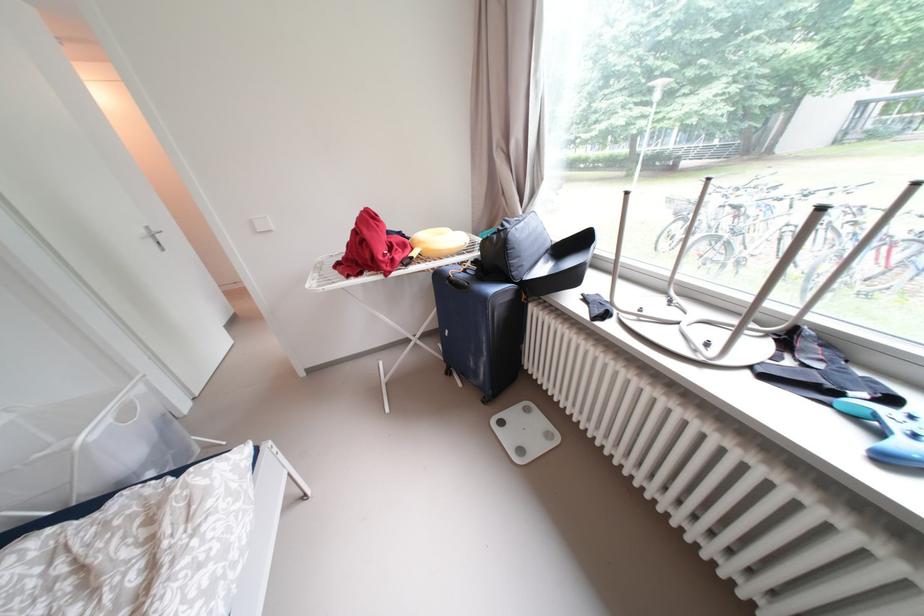
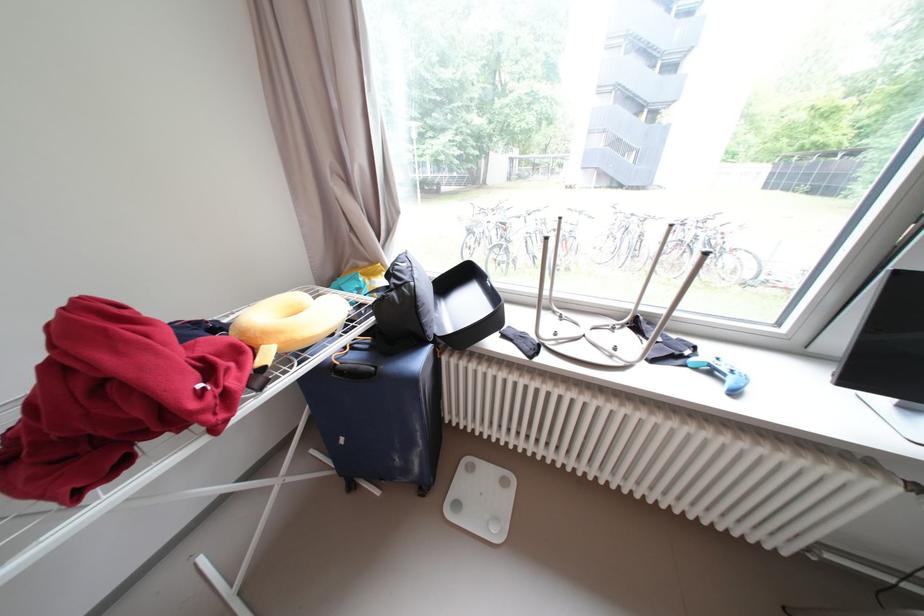
The point at (457, 277) is marked in the first image. Where is the corresponding point in the second image?

(344, 366)